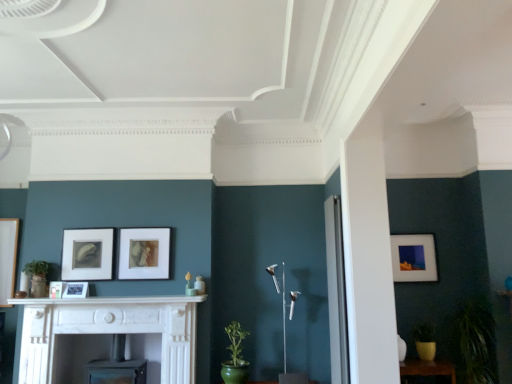
You are a GUI agent. You are given a task and a screenshot of the screen. Output one action in this format:
    pyautogui.click(x=<x>, y=<y>)
    Task: Click on the free space on the front side of matte black picture frame at center, marked as the fifth picture frame in a back-to-front arrangement
    
    Given the screenshot: What is the action you would take?
    pyautogui.click(x=44, y=300)